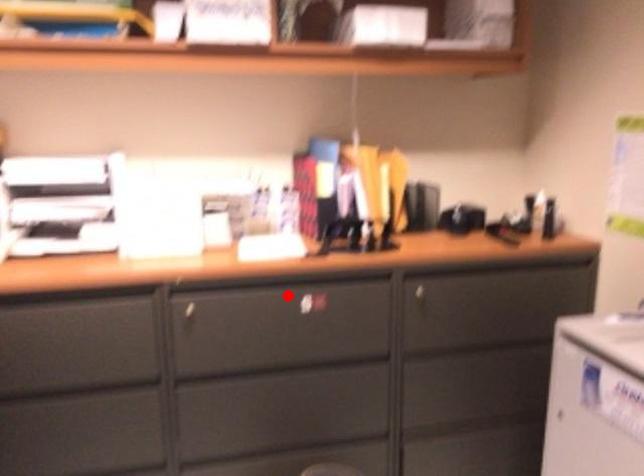
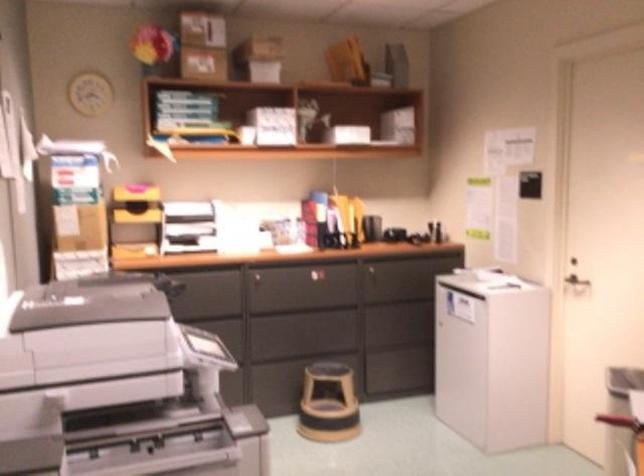
Question: A red point is marked in image1. In image2, is the corresponding 3D point closer to the camera or farther? Reply with the corresponding letter.

Choices:
 (A) The corresponding 3D point is closer.
 (B) The corresponding 3D point is farther.

Answer: (B)